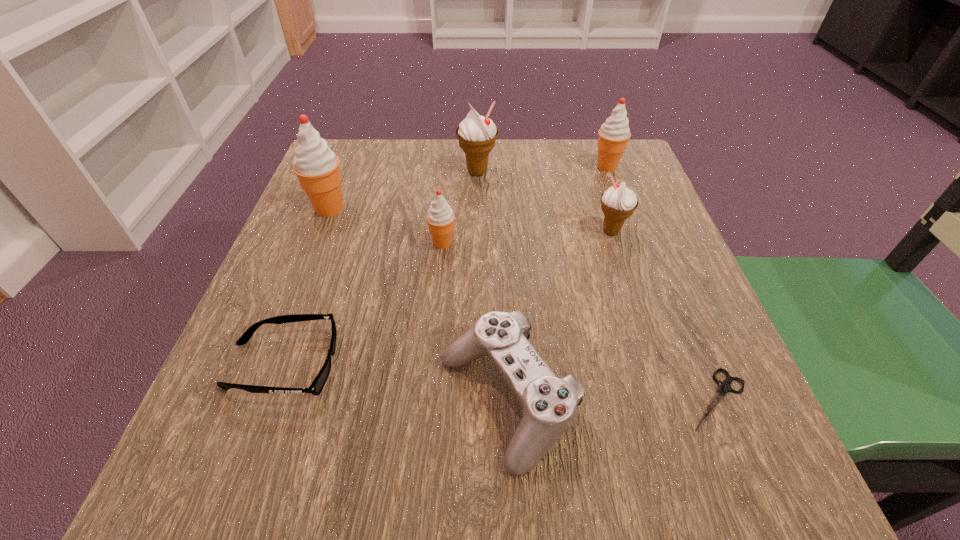
The height and width of the screenshot is (540, 960). I want to click on vacant space positioned 0.260m on the back of the nearer white icecream, so click(x=587, y=154).

This screenshot has width=960, height=540. I want to click on free region located 0.260m on the left of the white control, so click(256, 401).

The image size is (960, 540). I want to click on free space located on the front-facing side of the seventh tallest object, so click(x=594, y=365).

At what (x,y) coordinates should I click in order to perform the action: click on vacant area situated on the back of the black shears. Please return your answer as a coordinate pair (x, y). This screenshot has width=960, height=540. Looking at the image, I should click on (681, 308).

I want to click on object that is at the near edge, so click(x=549, y=403).

Image resolution: width=960 pixels, height=540 pixels. In order to click on icecream that is at the left edge in this screenshot , I will do `click(317, 167)`.

Identify the location of sunglasses at the left edge. This screenshot has height=540, width=960. (316, 387).

The width and height of the screenshot is (960, 540). Find the location of `shears that is at the right edge`. shears that is at the right edge is located at coordinates (724, 387).

Find the location of a particular element. This screenshot has height=540, width=960. object positioned at the far right corner is located at coordinates (614, 134).

In the image, there is a desktop. At what (x,y) coordinates should I click in order to perform the action: click on blank space at the far edge. Please return your answer as a coordinate pair (x, y). Image resolution: width=960 pixels, height=540 pixels. Looking at the image, I should click on (467, 177).